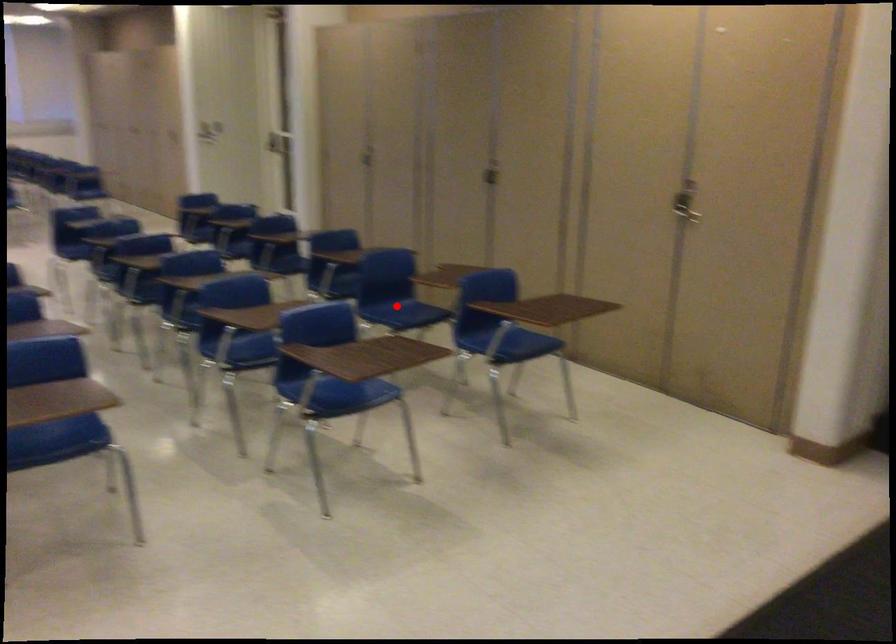
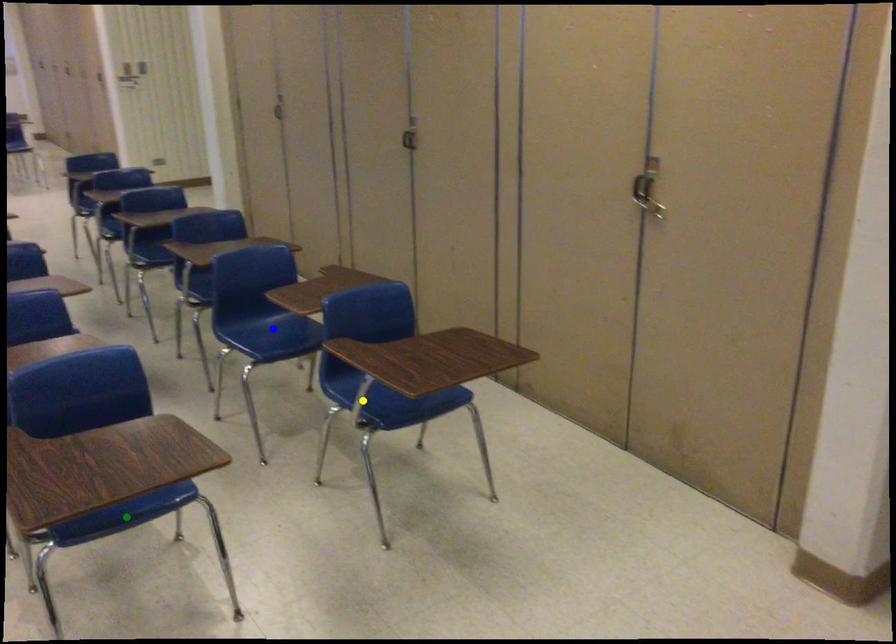
Question: I am providing you with two images of the same scene from different viewpoints. A red point is marked on the first image. You are given multiple points on the second image. Which spot in image 2 lines up with the point in image 1?

Choices:
 (A) yellow point
 (B) blue point
 (C) green point

Answer: (B)